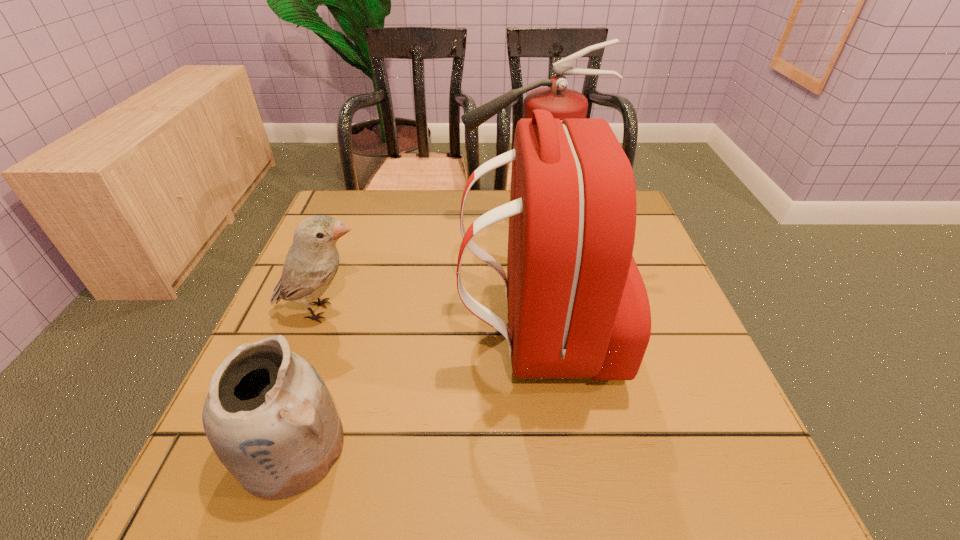
Where is `free space located 0.270m at the face of the bird`? Image resolution: width=960 pixels, height=540 pixels. free space located 0.270m at the face of the bird is located at coordinates (503, 311).

Find the location of a particular element. vacant space located 0.310m on the back of the pottery is located at coordinates (348, 281).

This screenshot has height=540, width=960. In order to click on object that is at the far edge in this screenshot , I will do `click(563, 103)`.

Find the location of `object present at the near edge`. object present at the near edge is located at coordinates (269, 417).

Where is `bird present at the left edge`? Image resolution: width=960 pixels, height=540 pixels. bird present at the left edge is located at coordinates (312, 261).

The height and width of the screenshot is (540, 960). Identify the location of pottery present at the left edge. (269, 417).

Find the location of a particular element. This screenshot has height=540, width=960. fire extinguisher present at the right edge is located at coordinates (563, 103).

The height and width of the screenshot is (540, 960). Find the location of `backpack that is at the right edge`. backpack that is at the right edge is located at coordinates (578, 307).

This screenshot has width=960, height=540. I want to click on object at the near left corner, so click(269, 417).

The width and height of the screenshot is (960, 540). I want to click on object that is at the far right corner, so click(x=563, y=103).